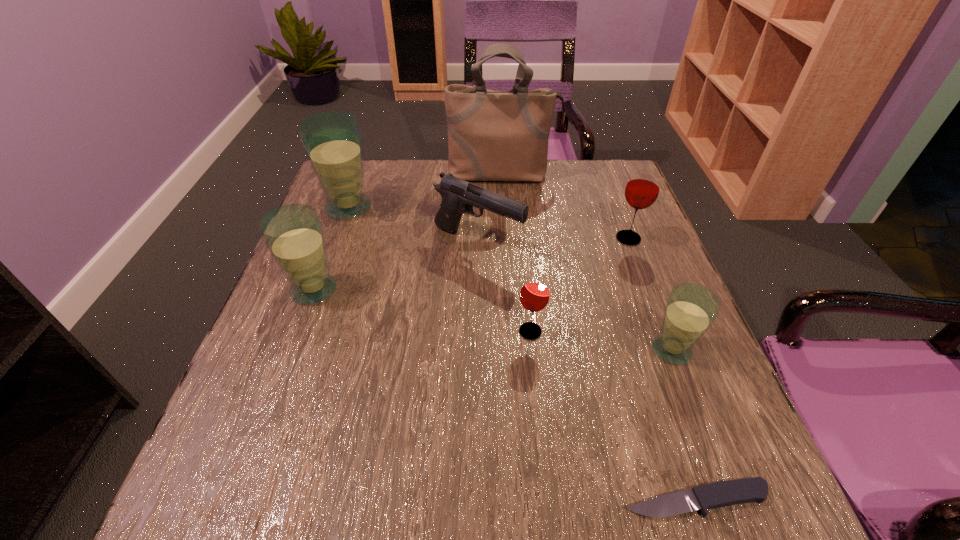
Identify the location of the tallest object. (493, 135).

Locate an element on the screen. The height and width of the screenshot is (540, 960). tan shoulder bag is located at coordinates (493, 135).

Where is `the tallest glass`? The width and height of the screenshot is (960, 540). the tallest glass is located at coordinates (332, 140).

Where is `the seventh shortest object`? the seventh shortest object is located at coordinates (332, 140).

Find the location of `the farther red glass`. the farther red glass is located at coordinates (642, 189).

I want to click on the fourth nearest glass, so click(642, 189).

Where is `the second smallest blue glass`? the second smallest blue glass is located at coordinates (293, 233).

The image size is (960, 540). Identify the location of the second farthest blue glass. (293, 233).

Where is `gun`? gun is located at coordinates (458, 196).

At what (x,y) coordinates should I click in order to perform the action: click on the third glass from right to left. Please return your answer as a coordinate pair (x, y). This screenshot has width=960, height=540. Looking at the image, I should click on (534, 295).